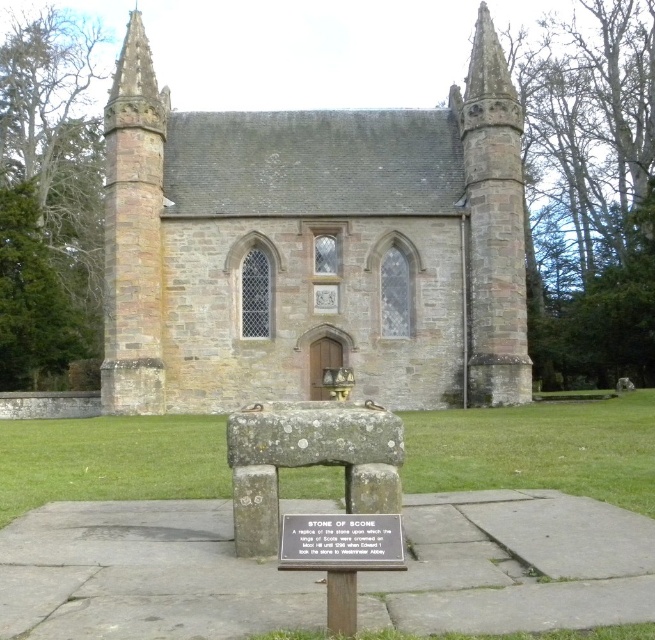
Is brown stone church at center positioned behind silver metallic plaque at center?

Yes, brown stone church at center is further from the viewer.

Between brown stone church at center and silver metallic plaque at center, which one is positioned higher?

Positioned higher is brown stone church at center.

You are a GUI agent. You are given a task and a screenshot of the screen. Output one action in this format:
    pyautogui.click(x=<x>, y=<y>)
    Task: Click on the brown stone church at center
    Image resolution: width=655 pixels, height=640 pixels.
    Given the screenshot: What is the action you would take?
    pyautogui.click(x=312, y=244)